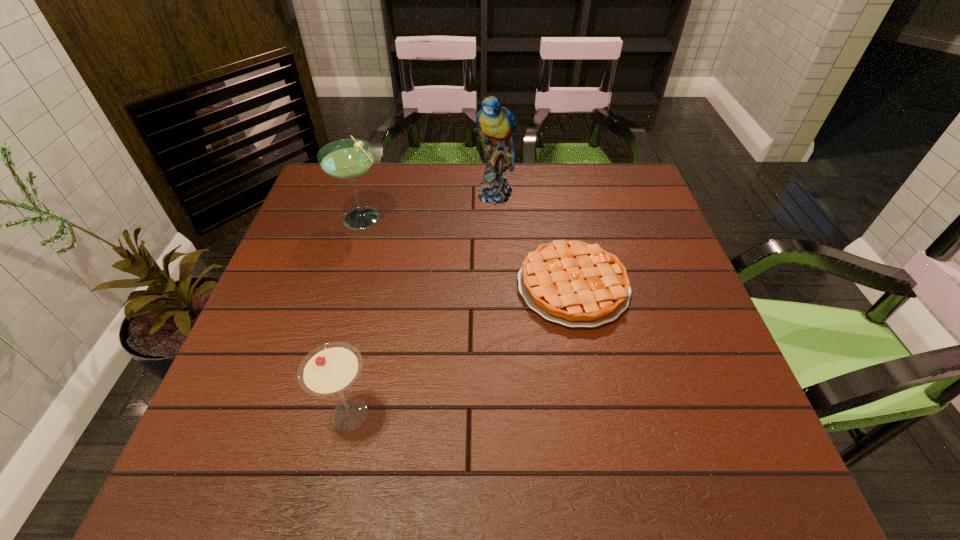
Locate an element on the screen. This screenshot has height=540, width=960. the tallest object is located at coordinates (497, 125).

This screenshot has height=540, width=960. I want to click on the third shortest object, so click(347, 159).

Image resolution: width=960 pixels, height=540 pixels. I want to click on the farther martini, so click(347, 159).

This screenshot has height=540, width=960. Find the location of `the third tallest object`. the third tallest object is located at coordinates (329, 369).

In order to click on the shorter martini in this screenshot , I will do `click(329, 369)`.

Locate an element on the screen. pie is located at coordinates (576, 284).

The width and height of the screenshot is (960, 540). I want to click on the third farthest object, so [x=576, y=284].

You are a GUI agent. You are given a task and a screenshot of the screen. Output one action in this format:
    pyautogui.click(x=<x>, y=<y>)
    Task: Click on the vacant space located 0.110m on the face of the tallest object
    This screenshot has width=960, height=540.
    Given the screenshot: What is the action you would take?
    pyautogui.click(x=496, y=234)

Locate an element on the screen. vacant area situated 0.120m on the back of the taller martini is located at coordinates (374, 178).

Locate an element on the screen. free region located 0.130m on the left of the shorter martini is located at coordinates [253, 415].